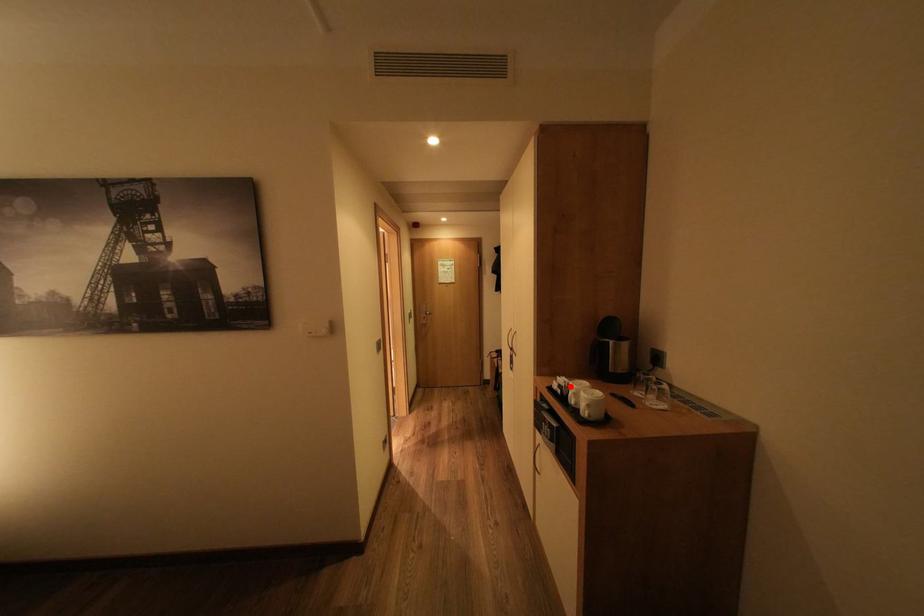
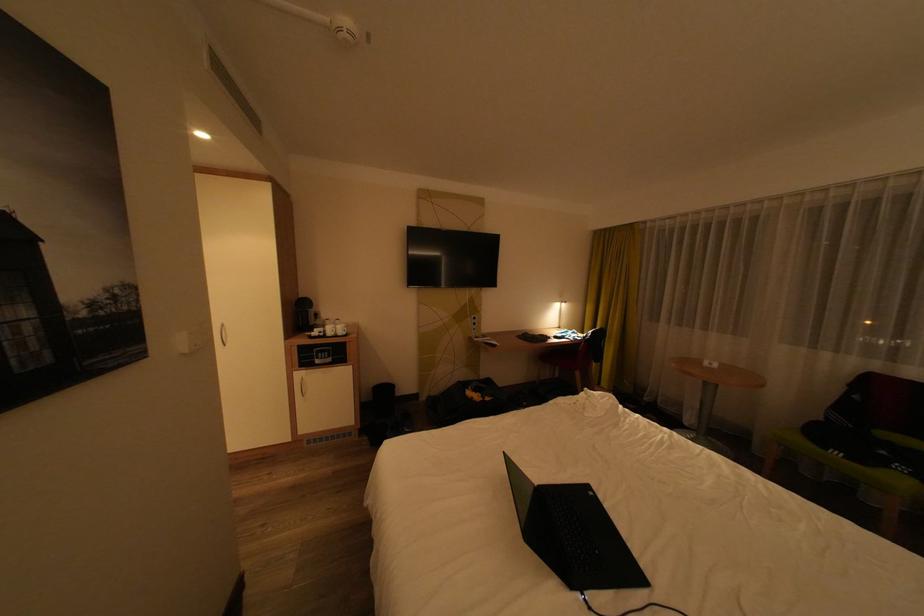
Where in the second image is the point corresponding to the highlighted location from the first image?

(331, 333)